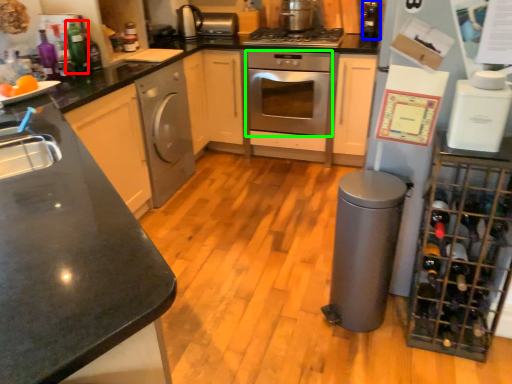
Question: Estimate the real-world distances between objects in this image. Which object is closer to bottle (highlighted by a red box), bottle (highlighted by a blue box) or oven (highlighted by a green box)?

Choices:
 (A) bottle
 (B) oven

Answer: (B)